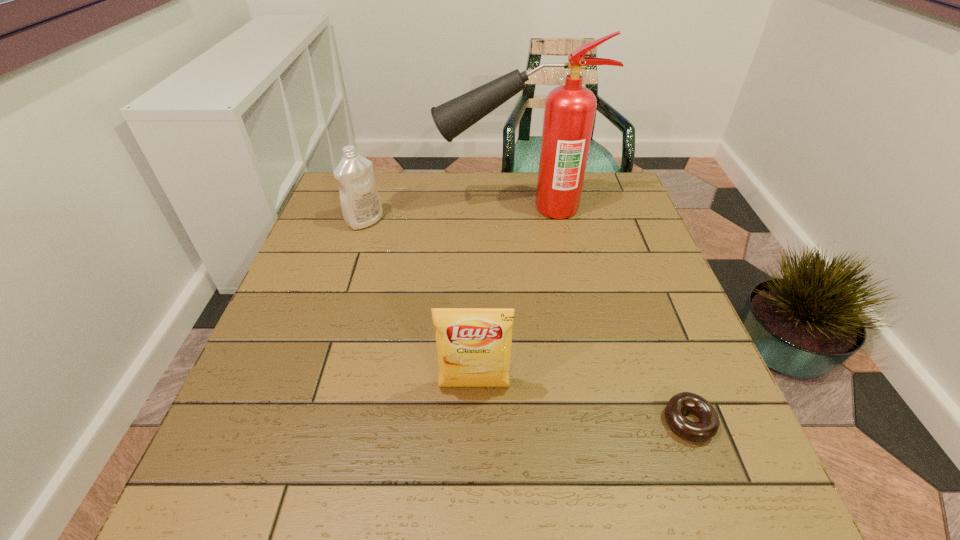
Image resolution: width=960 pixels, height=540 pixels. What are the coordinates of `free space at the right edge` in the screenshot? It's located at (645, 254).

This screenshot has height=540, width=960. Identify the location of free space at the far left corner of the desktop. (340, 195).

Where is `vacant space at the near left corner of the desktop`? The width and height of the screenshot is (960, 540). vacant space at the near left corner of the desktop is located at coordinates 207,470.

In the image, there is a desktop. Where is `vacant space at the far right corner`? Image resolution: width=960 pixels, height=540 pixels. vacant space at the far right corner is located at coordinates [x=602, y=177].

I want to click on vacant space at the near right corner, so click(x=755, y=491).

Find the location of `vacant space that is in between the leftmost object and the fire extinguisher`. vacant space that is in between the leftmost object and the fire extinguisher is located at coordinates (441, 214).

Find the location of a particular element. The height and width of the screenshot is (540, 960). empty space between the detergent and the fire extinguisher is located at coordinates (441, 214).

Where is `free space between the detergent and the nearest object`? Image resolution: width=960 pixels, height=540 pixels. free space between the detergent and the nearest object is located at coordinates (527, 322).

I want to click on vacant space in between the fire extinguisher and the doughnut, so click(x=602, y=315).

Find the location of `empty location between the leftmost object and the second nearest object`. empty location between the leftmost object and the second nearest object is located at coordinates (420, 304).